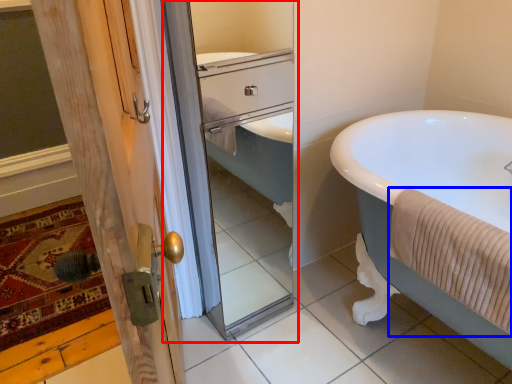
Question: Which object is closer to the camera taking this photo, screen door (highlighted by a red box) or bath towel (highlighted by a blue box)?

Choices:
 (A) screen door
 (B) bath towel

Answer: (B)